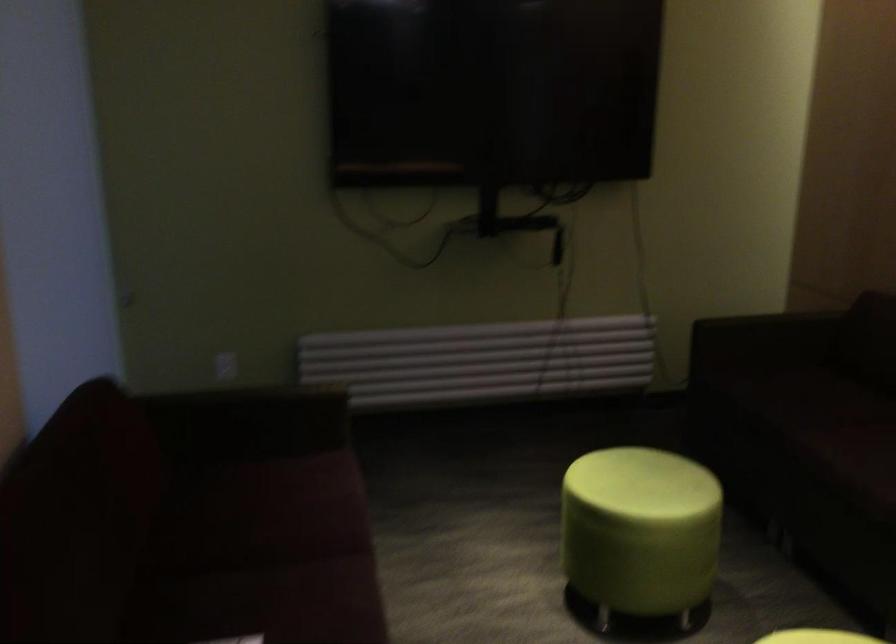
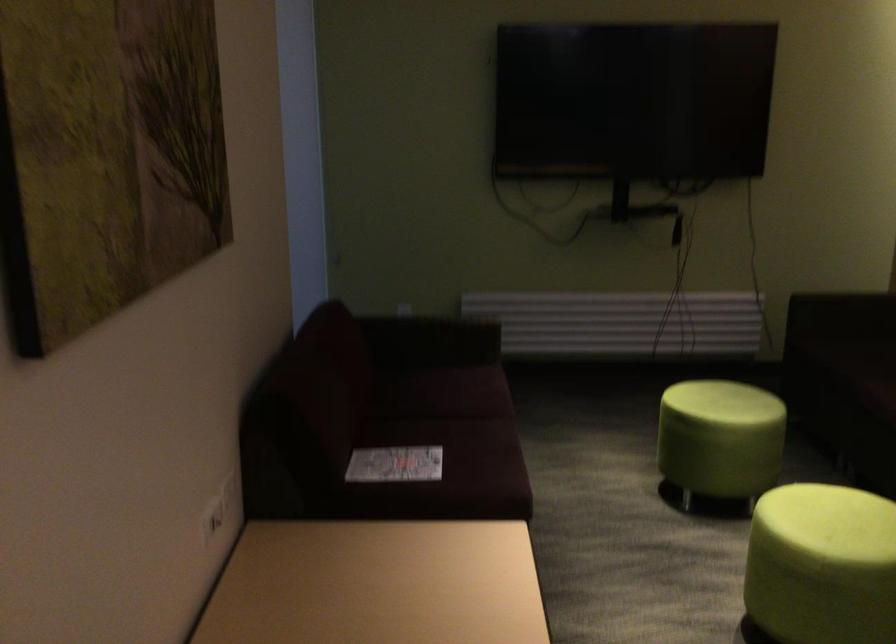
In the second image, find the point that corresponds to point 255,353 in the first image.

(437, 303)